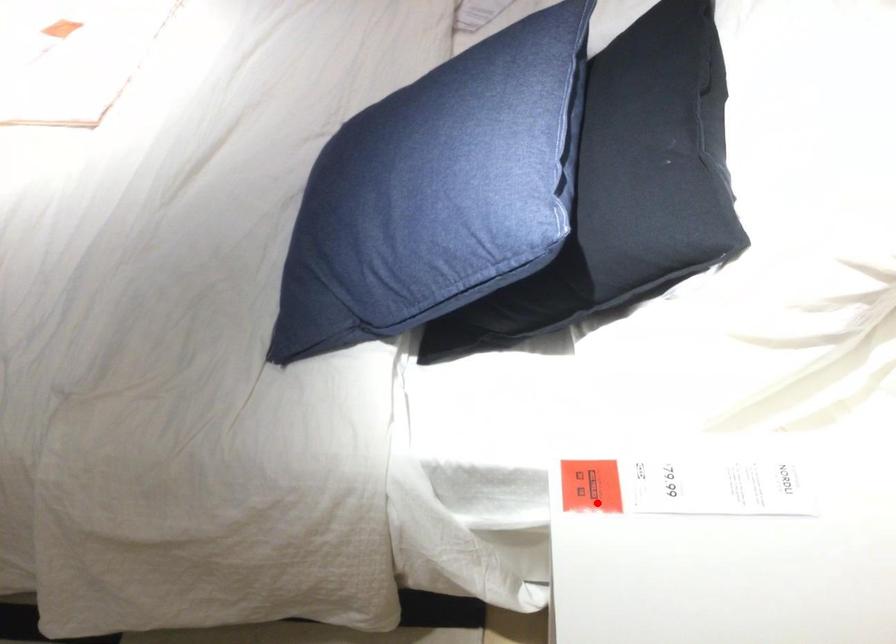
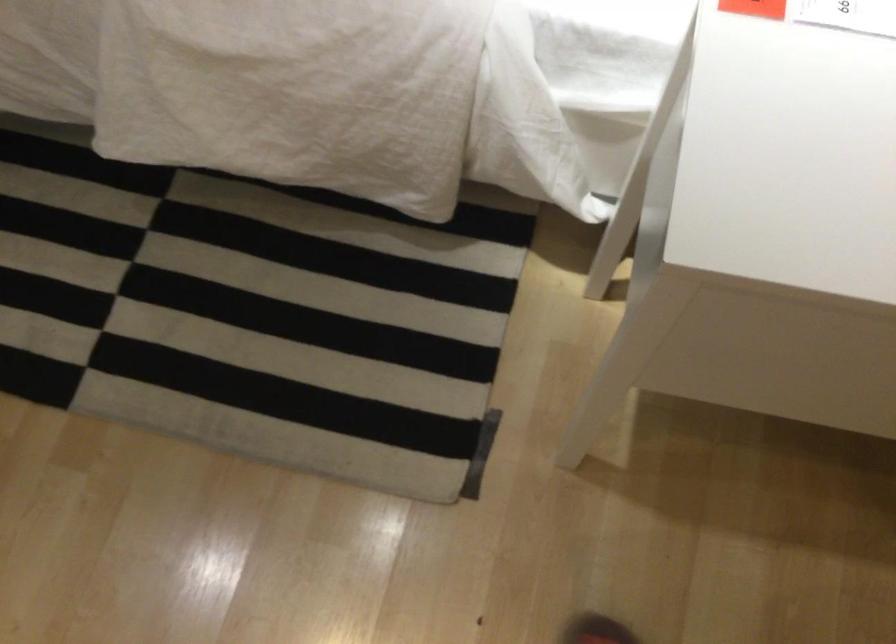
Question: I am providing you with two images of the same scene from different viewpoints. A red point is shown in image1. For the corresponding object point in image2, is it positioned nearer or farther from the camera?

Choices:
 (A) Nearer
 (B) Farther

Answer: (A)